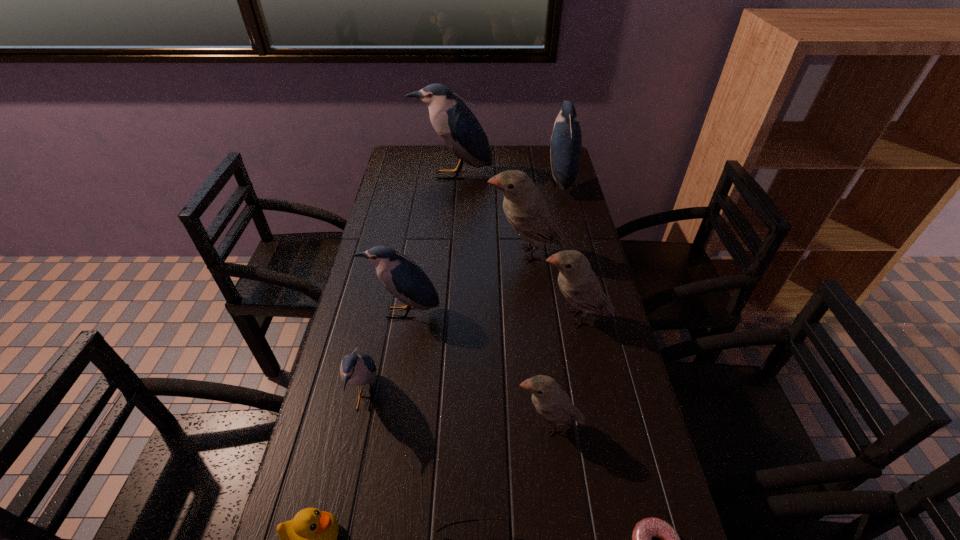
This screenshot has width=960, height=540. Find the location of `free space at the far right corner of the desktop`. free space at the far right corner of the desktop is located at coordinates pyautogui.click(x=549, y=156).

This screenshot has height=540, width=960. Find the location of `vacant space in between the nearest blue bird and the second biggest blue bird`. vacant space in between the nearest blue bird and the second biggest blue bird is located at coordinates (462, 290).

You are a GUI agent. You are given a task and a screenshot of the screen. Output one action in this format:
    pyautogui.click(x=<x>, y=<y>)
    Task: Click on the free area in between the nearest blue bird and the second biggest white bird
    The image size is (960, 540).
    Given the screenshot: What is the action you would take?
    pyautogui.click(x=470, y=359)

The height and width of the screenshot is (540, 960). I want to click on blank region between the second nearest white bird and the farthest white bird, so click(x=551, y=286).

Where is `vacant area between the second smallest blue bird and the second smallest white bird`? Image resolution: width=960 pixels, height=540 pixels. vacant area between the second smallest blue bird and the second smallest white bird is located at coordinates (489, 315).

Locate an element on the screen. The height and width of the screenshot is (540, 960). vacant area that lies between the biggest blue bird and the second smallest white bird is located at coordinates point(514,246).

What are the coordinates of `vacant space in between the smallest white bird and the second biggest white bird` in the screenshot? It's located at (563, 371).

The height and width of the screenshot is (540, 960). Identify the location of the seventh closest object to the smallest blue bird. (644, 530).

Point out which object is positioned as the fifth nearest to the third farthest object. Please provide its 2D coordinates. Your answer should be formatted as a tuple, i.e. [(x, y)], where the tuple contains the x and y coordinates of a point satisfying the conditions above.

[(357, 368)]

In order to click on bird that is the third closest to the nearest white bird in this screenshot , I will do `click(401, 276)`.